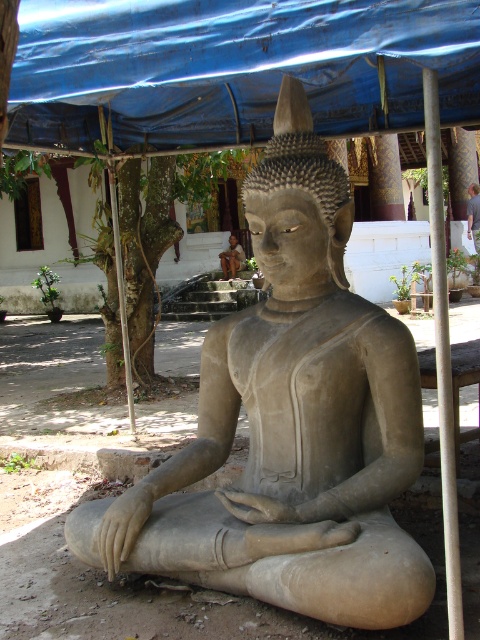
Does blue tarpaulin at upper center come in front of white smooth pole at right?

That is False.

Does point (342, 84) come closer to viewer compared to point (462, 618)?

No.

At what (x,y) coordinates should I click in order to perform the action: click on blue tarpaulin at upper center. Please return your answer as a coordinate pair (x, y). The width and height of the screenshot is (480, 640). Looking at the image, I should click on coord(233,68).

Is point (332, 614) farther from camera compared to point (120, 284)?

No, (332, 614) is closer to viewer.

Does point (344, 499) come farther from viewer compared to point (121, 328)?

No, (344, 499) is closer to viewer.

Where is `gray stone statue at center`? gray stone statue at center is located at coordinates (289, 424).

Is white smooth pole at right shorter than metallic pole at left?

In fact, white smooth pole at right may be taller than metallic pole at left.

Between point (443, 481) and point (110, 168), which one is positioned behind?

Point (110, 168)

Where is `white smooth pole at right`? white smooth pole at right is located at coordinates (443, 355).